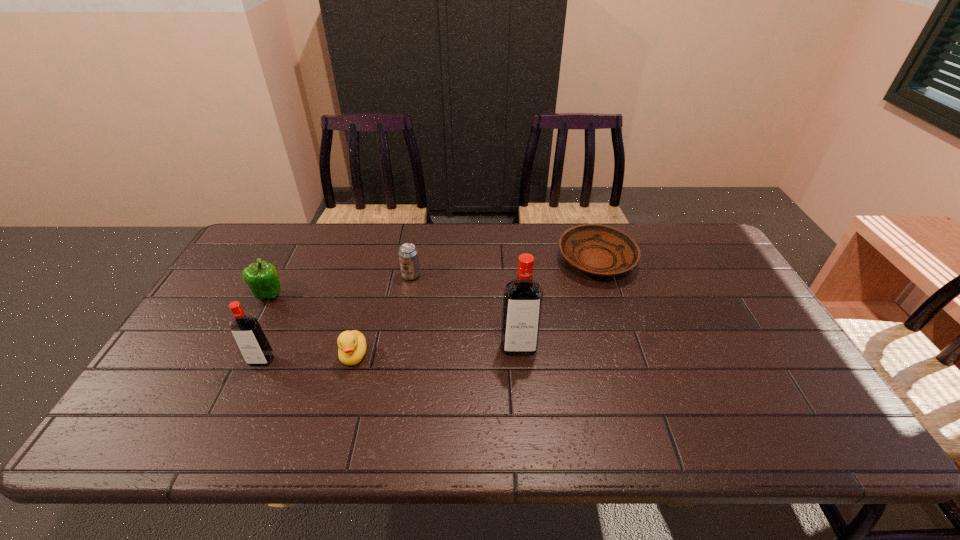
Where is `the left vodka`? The width and height of the screenshot is (960, 540). the left vodka is located at coordinates (251, 340).

Find the location of `the fifth shortest object`. the fifth shortest object is located at coordinates (251, 340).

Find the location of a particular element. This screenshot has width=960, height=540. the right vodka is located at coordinates (523, 297).

Find the location of `the taller vodka`. the taller vodka is located at coordinates click(x=523, y=297).

Where is `the rightmost object`? Image resolution: width=960 pixels, height=540 pixels. the rightmost object is located at coordinates (599, 250).

Identify the location of plate. (599, 250).

I want to click on beer can, so click(x=408, y=254).

Identify the location of the third shortest object. (408, 254).

You are a GUI agent. You are given a task and a screenshot of the screen. Output one action in this format:
    pyautogui.click(x=<x>, y=<y>)
    Task: Click on the second shortest object
    This screenshot has height=540, width=960.
    Given the screenshot: What is the action you would take?
    pyautogui.click(x=352, y=345)

Locate an element on the screen. This screenshot has width=960, height=540. the fourth object from right to left is located at coordinates (352, 345).